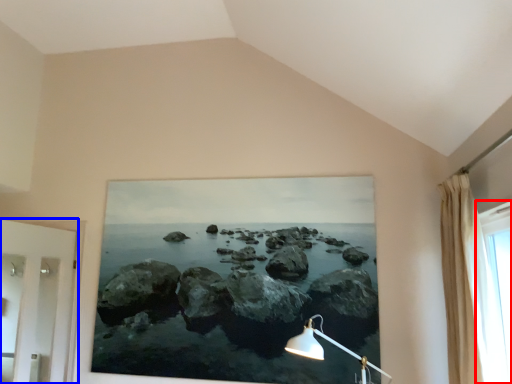
Question: Which object appears farthest to the camera in this image, window (highlighted by a red box) or door (highlighted by a blue box)?

Choices:
 (A) window
 (B) door

Answer: (B)